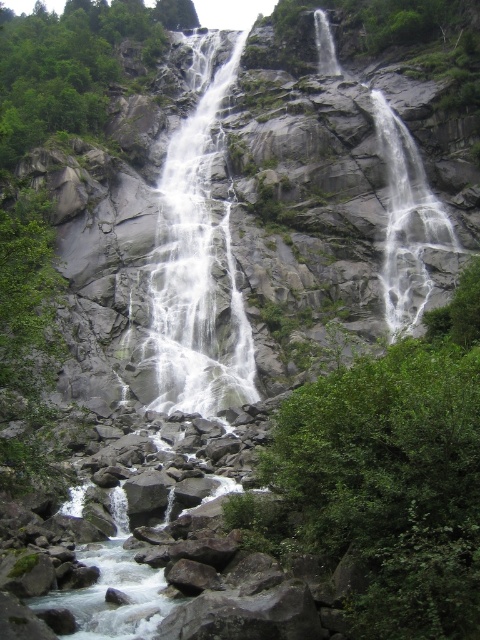
Is green leafy tree at upper left taller than white smooth waterfall at upper right?

Yes, green leafy tree at upper left is taller than white smooth waterfall at upper right.

Who is positioned more to the left, green leafy tree at upper left or white smooth waterfall at upper right?

From the viewer's perspective, green leafy tree at upper left appears more on the left side.

This screenshot has height=640, width=480. Identify the location of green leafy tree at upper left. (72, 65).

Does white frothy water at center have a smaller size compared to white smooth waterfall at upper right?

No, white frothy water at center is not smaller than white smooth waterfall at upper right.

Does point (247, 397) lie in front of point (392, 211)?

Yes, it is.

Where is `white frothy water at center`? white frothy water at center is located at coordinates (195, 268).

What do you see at coordinates (396, 474) in the screenshot?
I see `green leafy tree at center` at bounding box center [396, 474].

You are a GUI agent. You are given a task and a screenshot of the screen. Output one action in this format:
    pyautogui.click(x=<x>, y=<y>)
    Task: Click on the green leafy tree at center
    
    Given the screenshot: What is the action you would take?
    pyautogui.click(x=396, y=474)